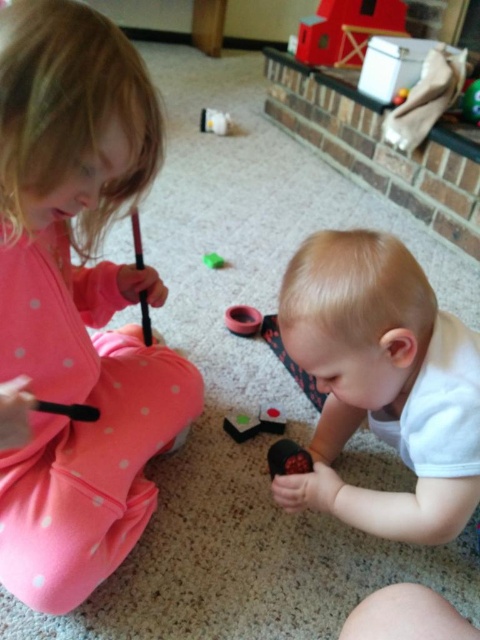
Question: Which of these objects is positioned closest to the white matte baby at lower center?

Choices:
 (A) rubber ring at center
 (B) matte pink pajamas at left
 (C) green rubber ball at center

Answer: (B)

Question: Which object is closer to the camera taking this photo?

Choices:
 (A) rubberized black toy at center
 (B) smooth plastic toy at center
 (C) green rubber ball at center
 (D) matte pink pajamas at left

Answer: (D)

Question: Can you confirm if matte pink pajamas at left is thinner than green rubber ball at center?

Choices:
 (A) no
 (B) yes

Answer: (A)

Question: Is the position of white matte baby at lower center more distant than that of rubberized black toy at center?

Choices:
 (A) no
 (B) yes

Answer: (A)

Question: Is rubber ring at center bigger than smooth plastic toy at center?

Choices:
 (A) no
 (B) yes

Answer: (B)

Question: Estimate the real-world distances between objects in this image. Which object is closer to the green rubber ball at center?

Choices:
 (A) green rubber toy at center
 (B) smooth plastic toy at center

Answer: (A)